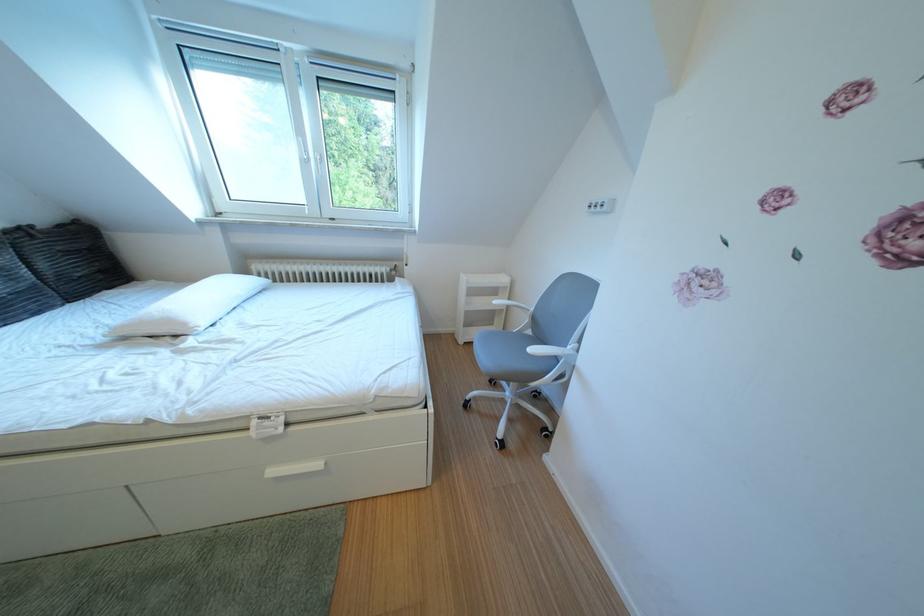
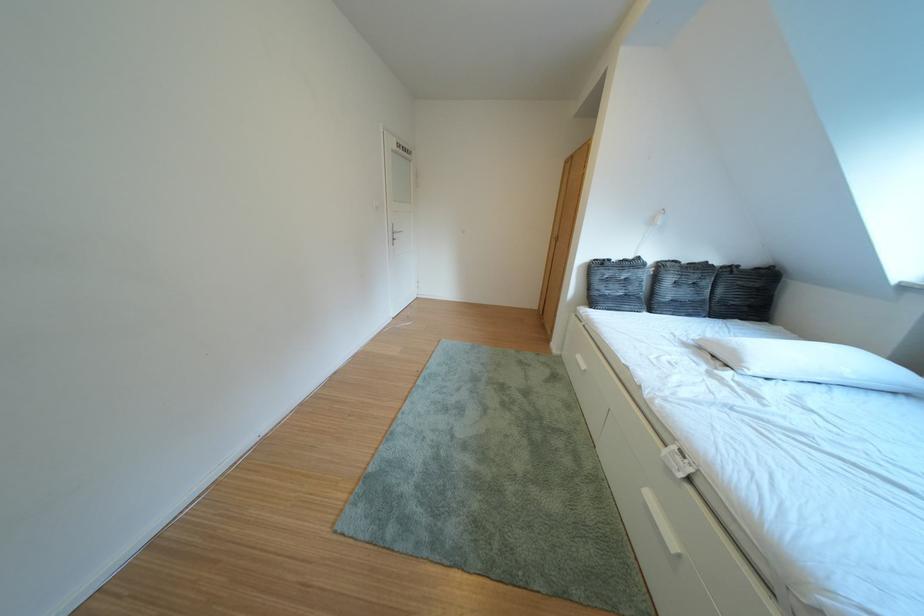
Based on the continuous images, in which direction is the camera rotating?

The rotation direction of the camera is left-down.